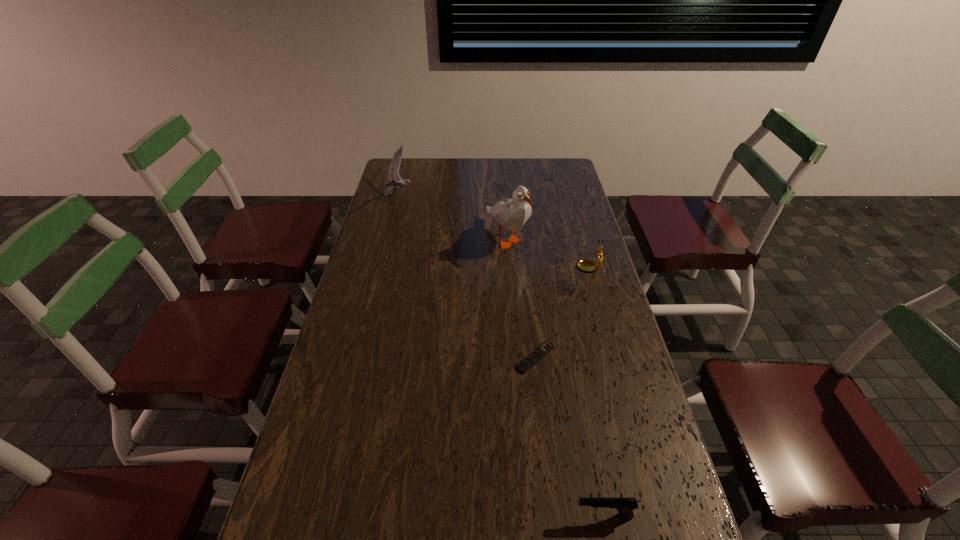
Identify the location of free space located 0.300m at the beak of the right gull. (514, 326).

You are a GUI agent. You are given a task and a screenshot of the screen. Output one action in this format:
    pyautogui.click(x=<x>, y=<y>)
    Task: Click on the free space located at the tip of the beak of the fourth shortest object
    
    Given the screenshot: What is the action you would take?
    pyautogui.click(x=494, y=196)

Where is `vacant region located 0.210m on the face of the rightmost object`? This screenshot has width=960, height=540. vacant region located 0.210m on the face of the rightmost object is located at coordinates (518, 270).

This screenshot has height=540, width=960. Find the location of `free region located on the face of the rightmost object`. free region located on the face of the rightmost object is located at coordinates (562, 270).

Where is `free space located on the face of the rightmost object`? free space located on the face of the rightmost object is located at coordinates (544, 270).

Image resolution: width=960 pixels, height=540 pixels. I want to click on free space located 0.350m at the muzzle of the pistol, so click(411, 516).

What are the coordinates of `free space located 0.100m at the muzzle of the pistol` in the screenshot? It's located at (527, 516).

Locate an element on the screen. vacant space located at the muzzle of the pistol is located at coordinates (430, 516).

Find the location of a particular element. free location located 0.060m on the right of the remote control is located at coordinates (577, 357).

Image resolution: width=960 pixels, height=540 pixels. What are the coordinates of `object that is at the far edge` in the screenshot? It's located at [x=396, y=182].